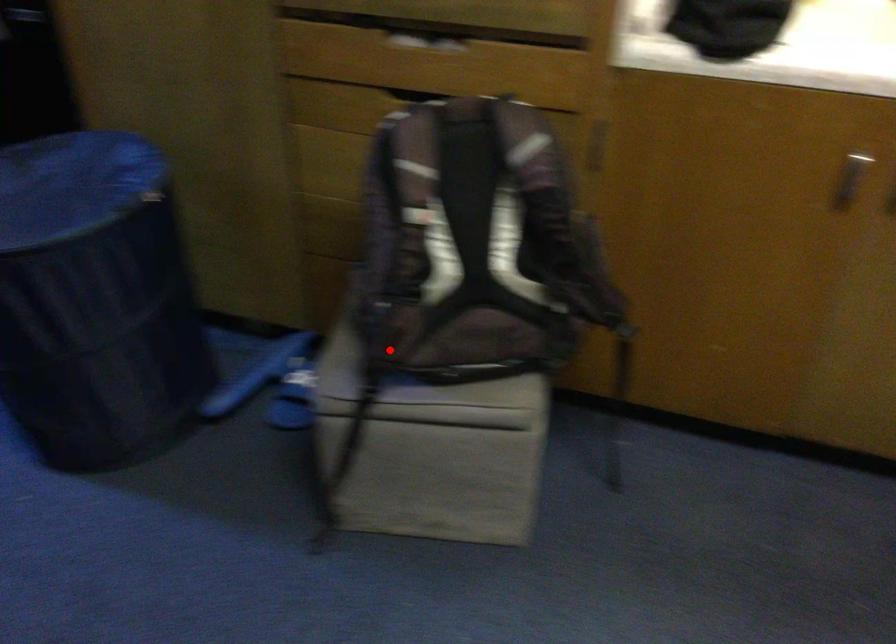
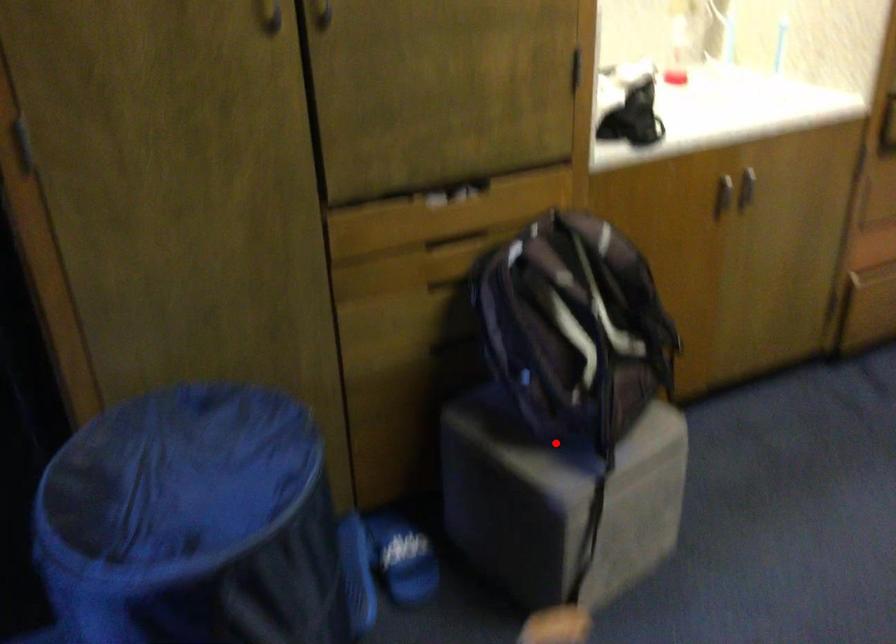
I am providing you with two images of the same scene from different viewpoints. A red point is marked on the first image and another point is marked on the second image. Does the point marked in image1 correspond to the same location as the one in image2?

Yes